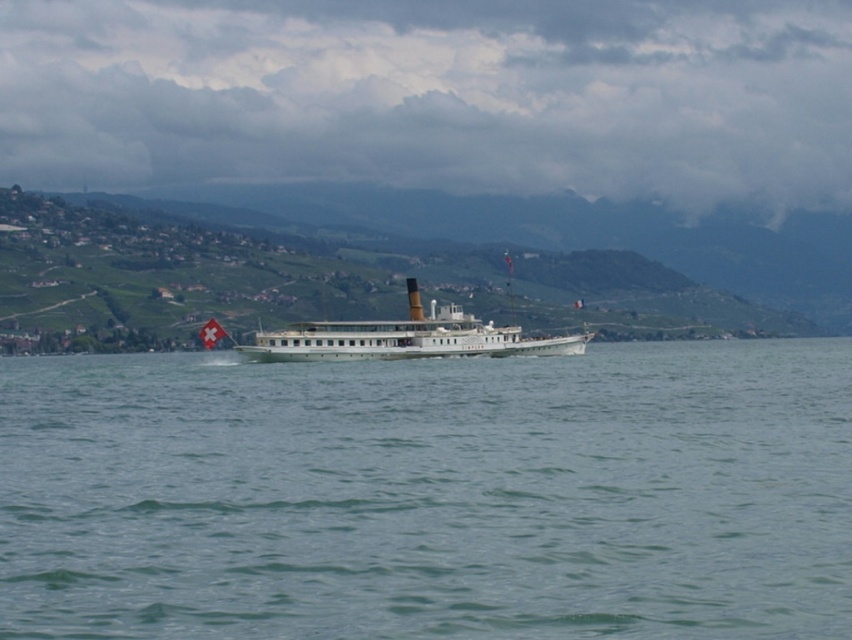
Question: Observing the image, what is the correct spatial positioning of green water at center in reference to white polished wood cruise ship at center?

Choices:
 (A) left
 (B) right

Answer: (A)

Question: Among these objects, which one is nearest to the camera?

Choices:
 (A) white polished wood cruise ship at center
 (B) green water at center

Answer: (B)

Question: Which point is closer to the camera?

Choices:
 (A) white polished wood cruise ship at center
 (B) green water at center

Answer: (B)

Question: Which point is closer to the camera taking this photo?

Choices:
 (A) (452, 340)
 (B) (281, 524)

Answer: (B)

Question: Does green water at center have a larger size compared to white polished wood cruise ship at center?

Choices:
 (A) yes
 (B) no

Answer: (A)

Question: Does green water at center appear on the right side of white polished wood cruise ship at center?

Choices:
 (A) yes
 (B) no

Answer: (B)